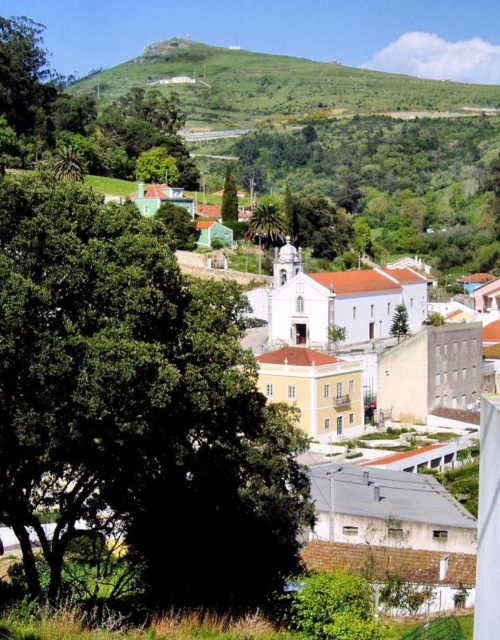
You are standing at the edge of the town square and want to take a photo of the green leafy tree at center. If your camera has a maximum focus range of 50 meters, will you be able to capture the tree clearly?

The green leafy tree at center is 54.30 meters away from the viewer. Since the camera can only focus up to 50 meters, it won

You are planning to place a picnic blanket in the scene. The green leafy tree at center provides shade, but you want to ensure there is enough space between the tree and the green grassy hillside at upper center for the blanket. Given that the blanket requires 3 meters of space, can you determine if there is sufficient space between them?

The green leafy tree at center has a lesser width compared to the green grassy hillside at upper center, but the description does not provide specific distance measurements between them. Therefore, it is unclear if the 3 meters of space required for the picnic blanket is available.

Based on the scene description, what object is located at point (x=273, y=84)?

The green grassy hillside at upper center is located at point (x=273, y=84).